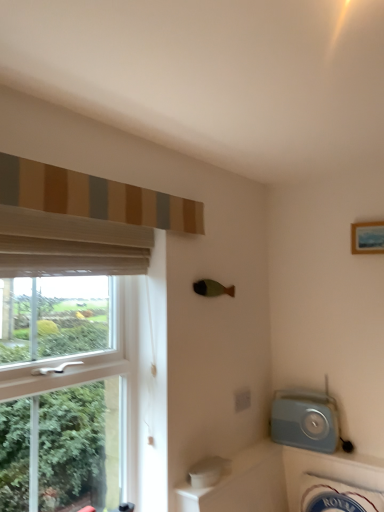
Find the location of a particular element. The width and height of the screenshot is (384, 512). free space above striped fabric curtain at upper left, the 2th curtain when ordered from bottom to top (from a real-world perspective) is located at coordinates (113, 178).